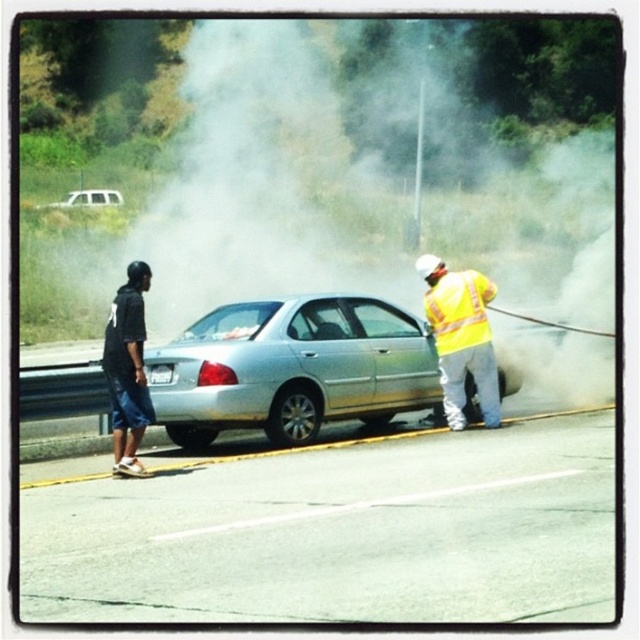
You are driving on the highway and need to make a quick turn. The smooth asphalt highway at center and the silver metallic suv at upper left are in your path. Which object will you have to maneuver around first?

The smooth asphalt highway at center is shorter than the silver metallic suv at upper left, so you will reach the smooth asphalt highway at center first and need to maneuver around it before the silver metallic suv at upper left.